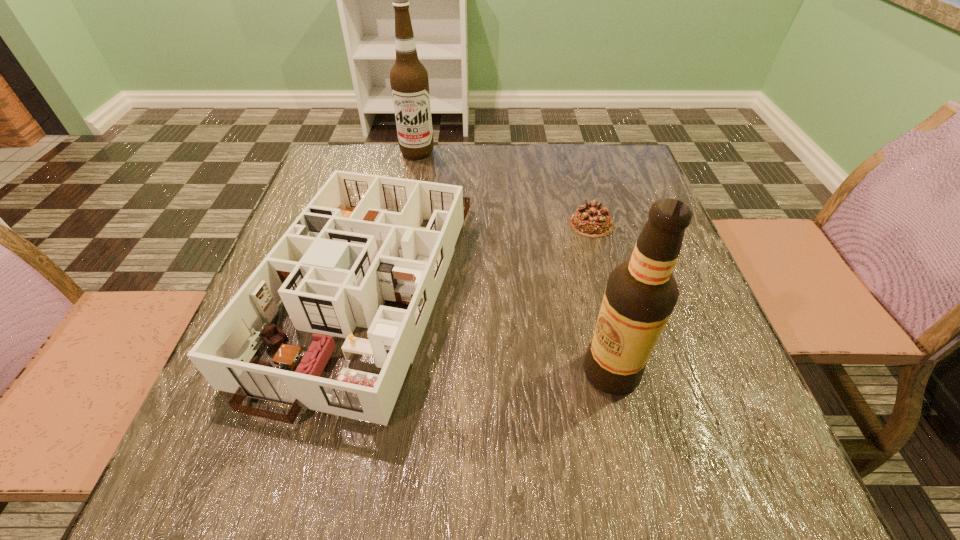
This screenshot has height=540, width=960. In order to click on blank space located 0.200m on the left of the chocolate cake in this screenshot , I will do (x=483, y=224).

Find the location of a particular element. object located in the far edge section of the desktop is located at coordinates (409, 81).

This screenshot has width=960, height=540. I want to click on object that is positioned at the left edge, so (359, 242).

In order to click on alcohol located in the right edge section of the desktop in this screenshot , I will do point(641,293).

The width and height of the screenshot is (960, 540). Identify the location of chocolate cake situated at the right edge. (591, 220).

Identify the location of vacant space at the far edge. This screenshot has width=960, height=540. (563, 184).

Where is `vacant space at the near edge of the desktop`? This screenshot has height=540, width=960. vacant space at the near edge of the desktop is located at coordinates (342, 498).

This screenshot has width=960, height=540. In the image, there is a desktop. Find the location of `free region at the right edge`. free region at the right edge is located at coordinates (629, 258).

I want to click on blank space at the far left corner of the desktop, so (x=358, y=170).

This screenshot has width=960, height=540. In the image, there is a desktop. Identify the location of vacant space at the far right corner. (622, 174).